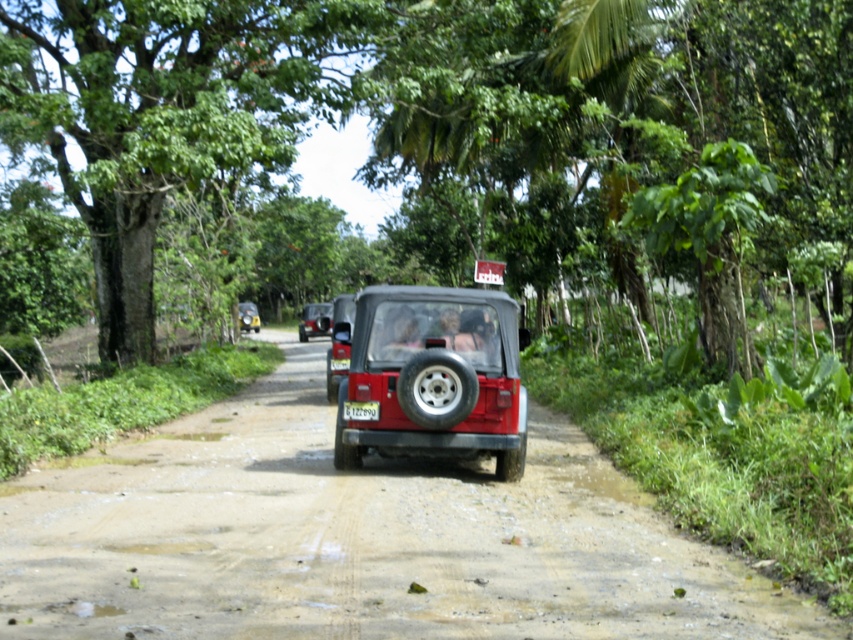
You are driving a matte red jeep at center on a dirt track at center. The road is narrow and muddy. Can you safely pass another vehicle coming from the opposite direction without going off the track?

The dirt track at center might be wider than matte red jeep at center, so there is a possibility that both vehicles can pass safely if the track width allows. However, caution is advised due to the muddy conditions which may affect traction and stability.

You are a hiker who needs to cross the dirt track at center. There is a metallic silver car at center approaching you. Can you safely cross before the car reaches you if you walk at a speed of 1.5 meters per second?

The distance between the dirt track at center and metallic silver car at center is 36.11 meters. If you walk at 1.5 meters per second, it would take you 24.07 seconds to cross. The car would take 36.11 divided by its speed to reach you. Without knowing the car speed, it is impossible to determine if you can cross safely.